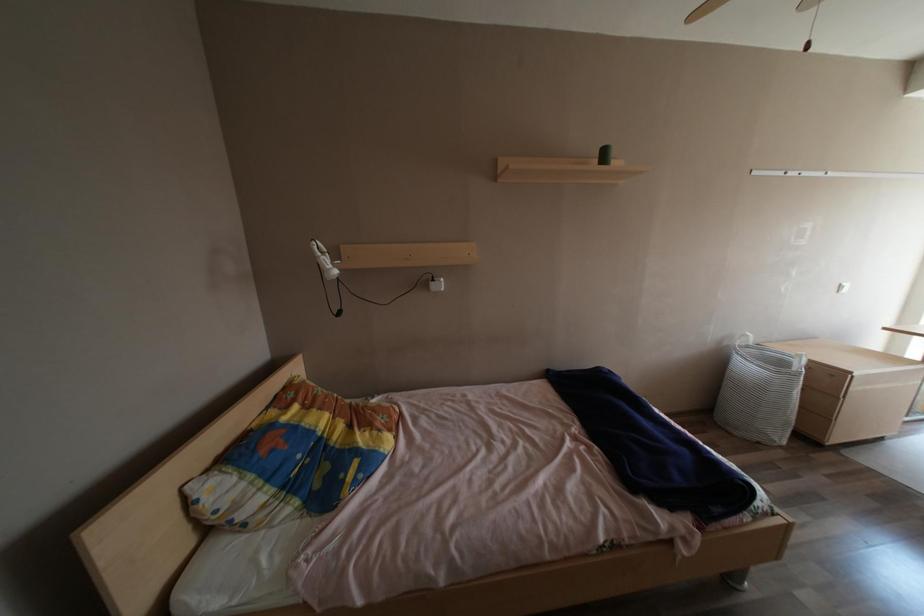
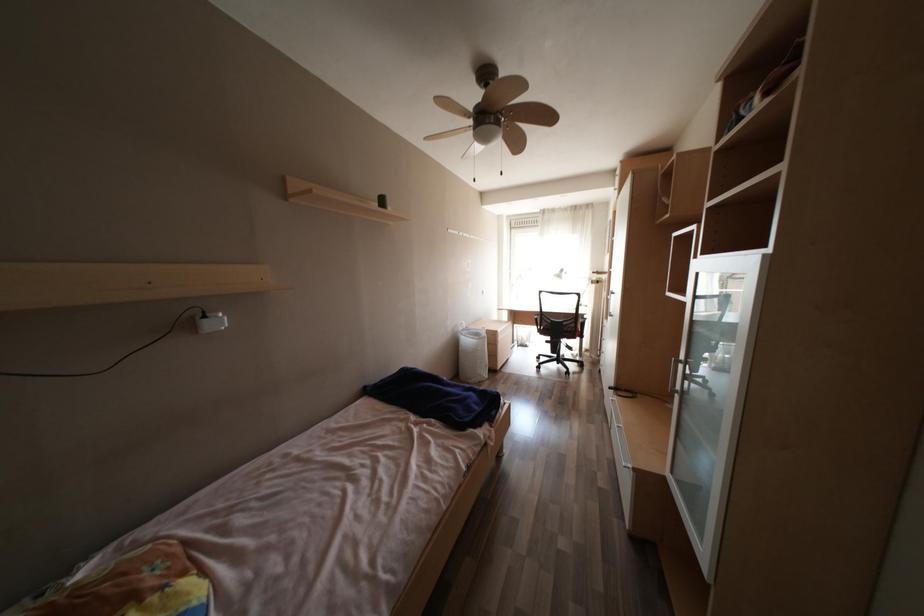
Question: Based on the continuous images, in which direction is the camera rotating? Reply with the corresponding letter.

Choices:
 (A) Left
 (B) Right
 (C) Up
 (D) Down

Answer: (B)